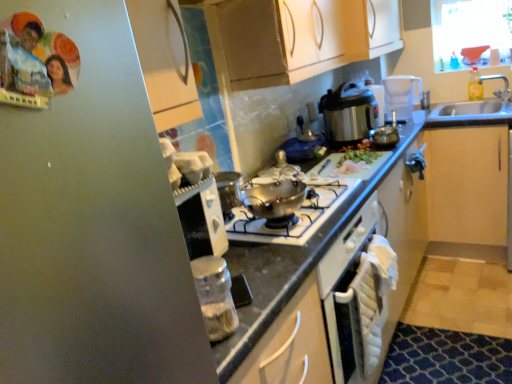
Question: Does light wood cabinet at right have a lesser width compared to clear glass jar at lower center, which is the 1th kitchen appliance from front to back?

Choices:
 (A) yes
 (B) no

Answer: (B)

Question: Does light wood cabinet at right have a larger size compared to clear glass jar at lower center, the first kitchen appliance positioned from the left?

Choices:
 (A) yes
 (B) no

Answer: (A)

Question: Does light wood cabinet at right appear on the right side of clear glass jar at lower center, the second kitchen appliance from the top?

Choices:
 (A) no
 (B) yes

Answer: (B)

Question: Can you confirm if light wood cabinet at right is wider than clear glass jar at lower center, the second kitchen appliance from the top?

Choices:
 (A) no
 (B) yes

Answer: (B)

Question: Does light wood cabinet at right have a lesser height compared to clear glass jar at lower center, which is the 2th kitchen appliance in back-to-front order?

Choices:
 (A) no
 (B) yes

Answer: (A)

Question: Are light wood cabinet at right and clear glass jar at lower center, the first kitchen appliance positioned from the left, beside each other?

Choices:
 (A) yes
 (B) no

Answer: (B)

Question: Can shiny metallic pot at center be found inside light wood cabinet at right?

Choices:
 (A) no
 (B) yes

Answer: (A)

Question: Is light wood cabinet at right next to shiny metallic pot at center?

Choices:
 (A) yes
 (B) no

Answer: (B)

Question: From the image's perspective, is light wood cabinet at right on top of shiny metallic pot at center?

Choices:
 (A) yes
 (B) no

Answer: (A)

Question: Does light wood cabinet at right have a greater width compared to shiny metallic pot at center?

Choices:
 (A) no
 (B) yes

Answer: (B)

Question: Would you say light wood cabinet at right is a long distance from shiny metallic pot at center?

Choices:
 (A) yes
 (B) no

Answer: (A)

Question: Does light wood cabinet at right have a greater height compared to shiny metallic pot at center?

Choices:
 (A) no
 (B) yes

Answer: (B)

Question: Is stainless steel pressure cooker at upper right, the 2th kitchen appliance ordered from the bottom, far from clear plastic bottle at upper right?

Choices:
 (A) yes
 (B) no

Answer: (A)